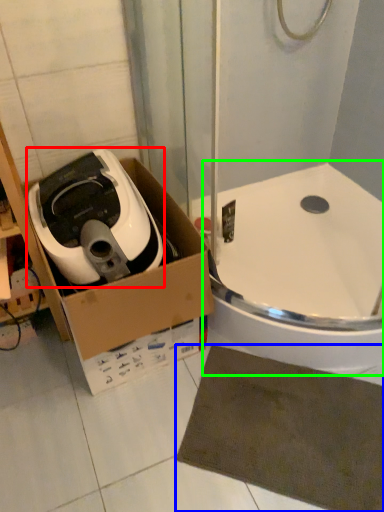
Question: Considering the real-world distances, which object is closest to home appliance (highlighted by a red box)? bath mat (highlighted by a blue box) or bath (highlighted by a green box).

Choices:
 (A) bath mat
 (B) bath

Answer: (B)